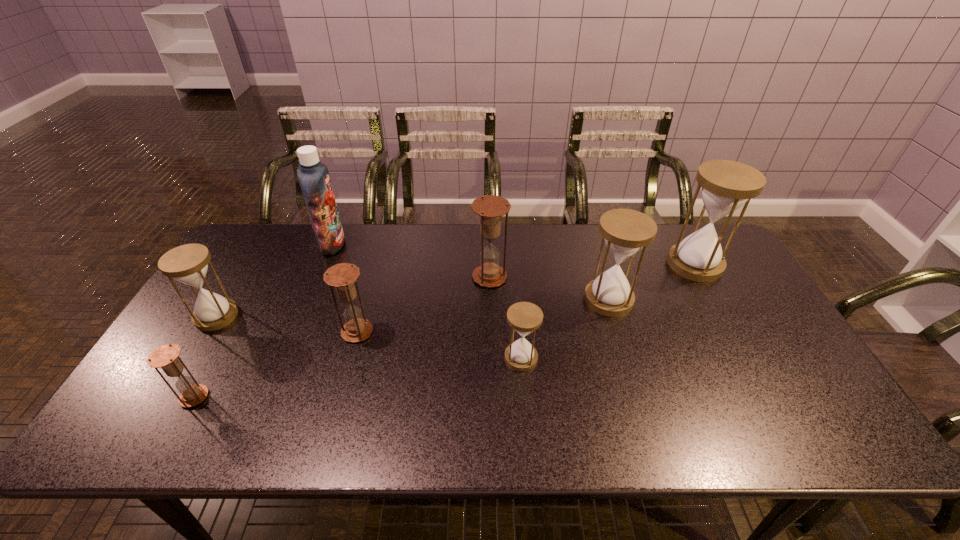
Where is `free spot between the rightmost white hourglass and the second smallest brown hourglass`? free spot between the rightmost white hourglass and the second smallest brown hourglass is located at coordinates (526, 298).

Find the location of a particular element. empty location between the nearest hourglass and the second object from right to left is located at coordinates (401, 348).

You are a GUI agent. You are given a task and a screenshot of the screen. Output one action in this format:
    pyautogui.click(x=<x>, y=<y>)
    Task: Click on the object that is the fourth closest one to the third biggest white hourglass
    This screenshot has width=960, height=540.
    Given the screenshot: What is the action you would take?
    pyautogui.click(x=490, y=208)

This screenshot has height=540, width=960. Find the location of `the sixth closest object to the sixth farthest hourglass`. the sixth closest object to the sixth farthest hourglass is located at coordinates (166, 357).

Select which hourglass is the sixth closest to the second brown hourglass from right to left. Please provide its 2D coordinates. Your answer should be formatted as a tuple, i.e. [(x, y)], where the tuple contains the x and y coordinates of a point satisfying the conditions above.

[(726, 185)]

Identify the location of the second closest hourglass to the rightmost white hourglass. point(524,317).

Choose which white hourglass is the fourth nearest neighbor to the fifth hourglass from right to left. Please provide its 2D coordinates. Your answer should be formatted as a tuple, i.e. [(x, y)], where the tuple contains the x and y coordinates of a point satisfying the conditions above.

[(726, 185)]

I want to click on white hourglass that stands as the second closest to the second nearest object, so click(726, 185).

Select which brown hourglass is the closest to the leftmost white hourglass. Please provide its 2D coordinates. Your answer should be formatted as a tuple, i.e. [(x, y)], where the tuple contains the x and y coordinates of a point satisfying the conditions above.

[(166, 357)]

Select which brown hourglass appears as the second closest to the second smallest white hourglass. Please provide its 2D coordinates. Your answer should be formatted as a tuple, i.e. [(x, y)], where the tuple contains the x and y coordinates of a point satisfying the conditions above.

[(342, 276)]